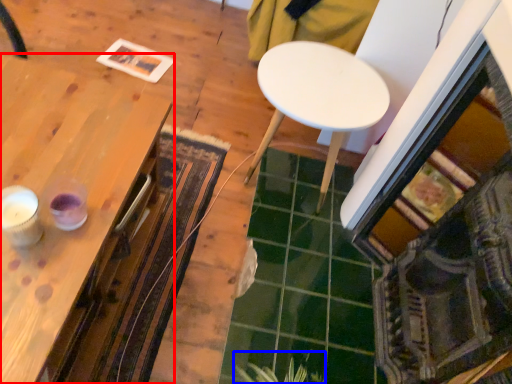
Question: Which object appears closest to the camera in this image, table (highlighted by a red box) or plant (highlighted by a blue box)?

Choices:
 (A) table
 (B) plant

Answer: (A)